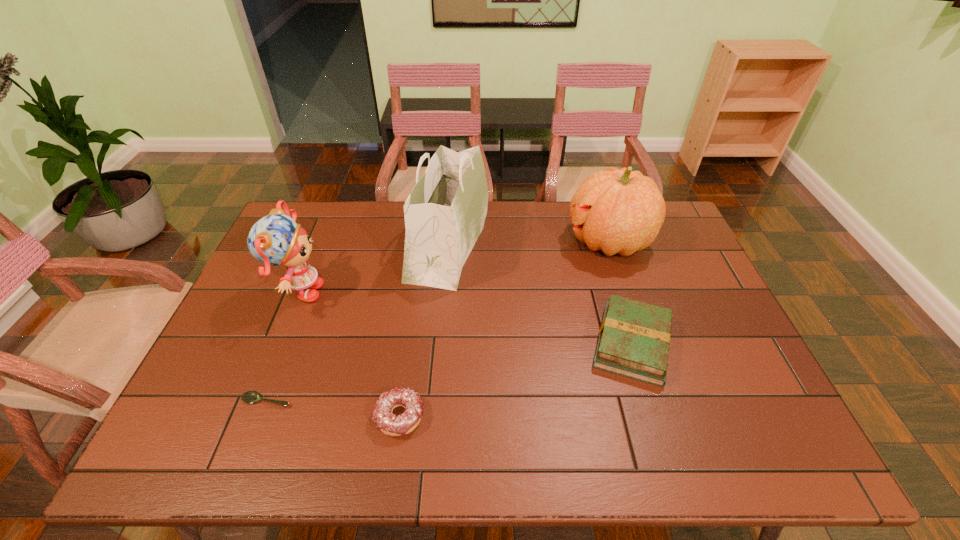
In order to click on object at the far right corner in this screenshot , I will do `click(621, 211)`.

Image resolution: width=960 pixels, height=540 pixels. In order to click on vacant space at the far edge in this screenshot , I will do `click(501, 234)`.

Find the location of a particular element. free space at the near edge of the desktop is located at coordinates (684, 459).

This screenshot has height=540, width=960. In the image, there is a desktop. What are the coordinates of `free space at the left edge` in the screenshot? It's located at (263, 326).

In the image, there is a desktop. Identify the location of free region at the right edge. This screenshot has height=540, width=960. (777, 411).

Where is `vacant space at the far left corner of the desktop`? vacant space at the far left corner of the desktop is located at coordinates (324, 218).

What are the coordinates of `free point between the grocery bag and the fifth tallest object` in the screenshot? It's located at (424, 329).

What are the coordinates of `vacant area between the book and the shortest object` in the screenshot? It's located at (449, 372).

Locate an element on the screen. free space that is in between the doll and the second shortest object is located at coordinates (349, 355).

What are the coordinates of `empty space between the soupspoon and the book` in the screenshot? It's located at (449, 372).